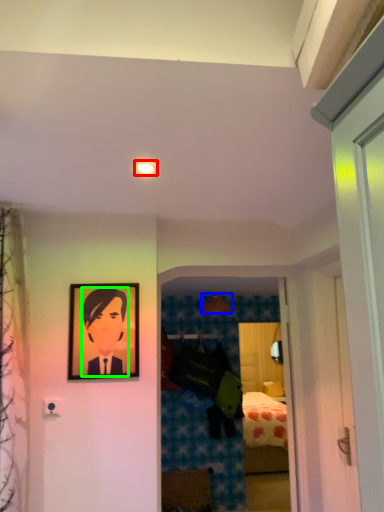
Question: Based on their relative distances, which object is nearer to lighting (highlighted by a red box)? Choose from lamp (highlighted by a blue box) and person (highlighted by a green box).

Choices:
 (A) lamp
 (B) person

Answer: (B)